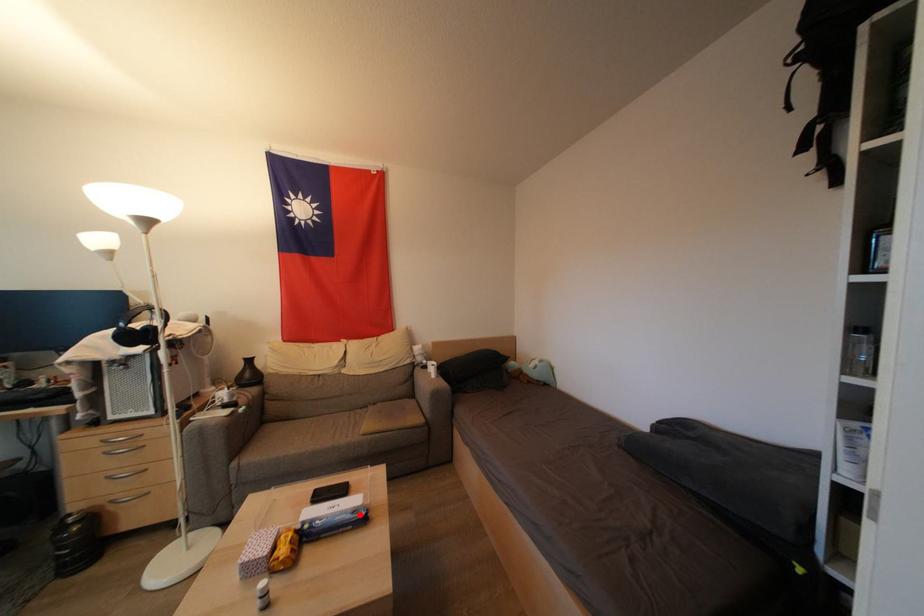
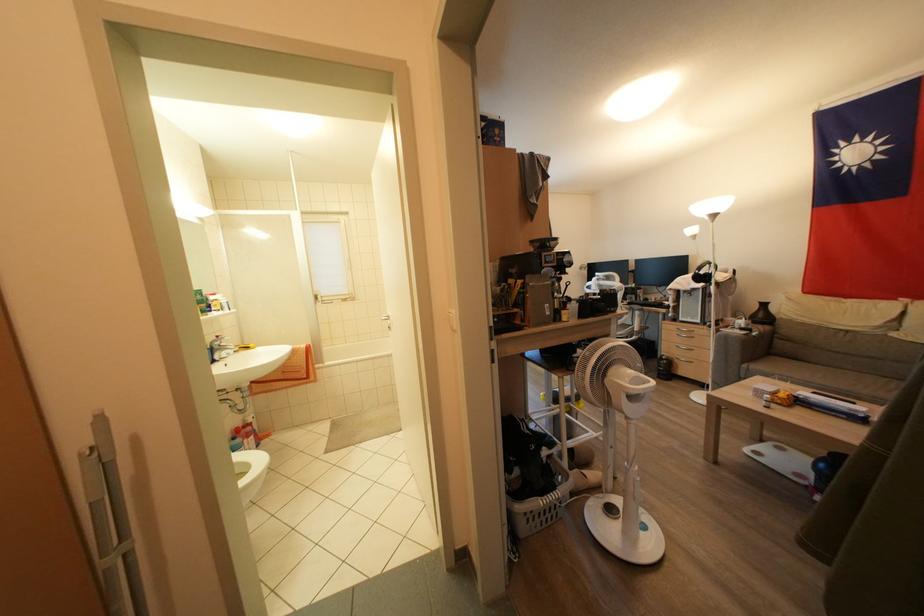
Question: I am providing you with two images of the same scene from different viewpoints. A red point is shown in image1. For the corresponding object point in image2, is it positioned nearer or farther from the camera?

Choices:
 (A) Nearer
 (B) Farther

Answer: (B)